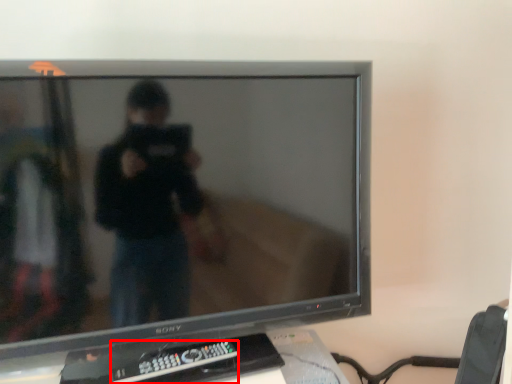
Question: From the image's perspective, considering the relative positions of remote control (annotated by the red box) and television in the image provided, where is remote control (annotated by the red box) located with respect to the staircase?

Choices:
 (A) below
 (B) above

Answer: (A)